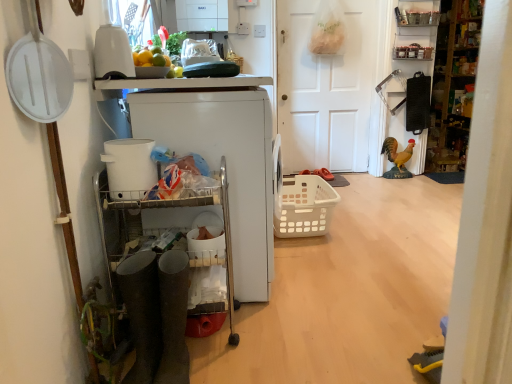
Question: Considering the positions of white plastic cart at left, which appears as the 3th appliance when viewed from the front, and yellow matte rooster at right in the image, is white plastic cart at left, which appears as the 3th appliance when viewed from the front, wider or thinner than yellow matte rooster at right?

Choices:
 (A) thin
 (B) wide

Answer: (B)

Question: From the image's perspective, relative to yellow matte rooster at right, is white plastic cart at left, which appears as the 3th appliance when viewed from the front, above or below?

Choices:
 (A) above
 (B) below

Answer: (B)

Question: Considering the real-world distances, which object is farthest from the yellow matte rooster at right?

Choices:
 (A) wooden shelves at right, which appears as the first cabinetry when viewed from the right
 (B) white plastic basket at center
 (C) metallic gray boots at left, which ranks as the 1th cabinetry in bottom-to-top order
 (D) metallic silver spice rack at upper right, the second shelf viewed from the top
 (E) white matte door at center

Answer: (C)

Question: Considering the real-world distances, which object is closest to the metallic gray boots at left, which ranks as the 1th cabinetry in bottom-to-top order?

Choices:
 (A) wooden shelves at right, which appears as the first cabinetry when viewed from the right
 (B) yellow matte rooster at right
 (C) metallic silver spice rack at upper right, the second shelf viewed from the top
 (D) white plastic cart at left, which appears as the 3th appliance when viewed from the front
 (E) metallic silver shelf at upper right, placed as the 2th shelf when sorted from bottom to top

Answer: (D)